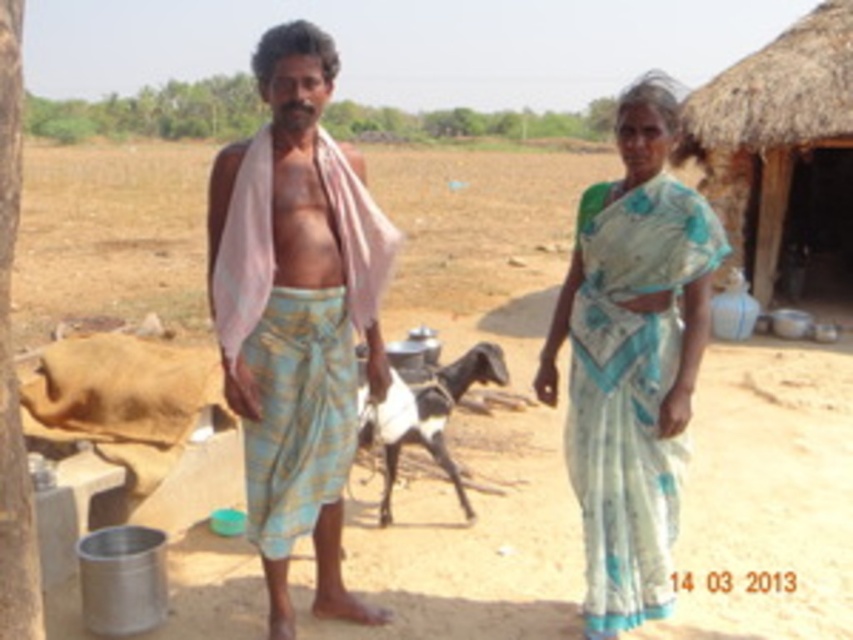
You are planning to take a photo of the light blue printed saree at center and the thatched straw hut at right. Since you want both to be clearly visible in the frame, which one should you focus on first to ensure proper focus?

The light blue printed saree at center should be focused on first because it is smaller in size compared to the thatched straw hut at right, so capturing its details requires precise focus.

You are a photographer trying to capture the scene. You need to position yourself so that the white silk saree at center and the black and white fur goat at center are both in frame. Based on their positions, which object should be placed on the left side of your photo?

The black and white fur goat at center should be placed on the left side of the photo because the white silk saree at center is to the right of it.